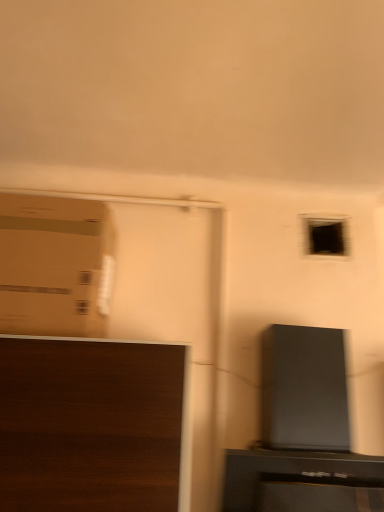
Question: Does cardboard box at left have a lesser width compared to dark wood cabinet at lower left?

Choices:
 (A) no
 (B) yes

Answer: (B)

Question: Is cardboard box at left closer to the viewer compared to dark wood cabinet at lower left?

Choices:
 (A) no
 (B) yes

Answer: (A)

Question: From a real-world perspective, is cardboard box at left on top of dark wood cabinet at lower left?

Choices:
 (A) no
 (B) yes

Answer: (B)

Question: From the image's perspective, is cardboard box at left below dark wood cabinet at lower left?

Choices:
 (A) no
 (B) yes

Answer: (A)

Question: Is cardboard box at left facing away from dark wood cabinet at lower left?

Choices:
 (A) yes
 (B) no

Answer: (B)

Question: Is cardboard box at left in contact with dark wood cabinet at lower left?

Choices:
 (A) no
 (B) yes

Answer: (A)

Question: From the image's perspective, does dark wood cabinet at lower left appear higher than cardboard box at left?

Choices:
 (A) no
 (B) yes

Answer: (A)

Question: Is dark wood cabinet at lower left looking in the opposite direction of cardboard box at left?

Choices:
 (A) no
 (B) yes

Answer: (A)

Question: Does dark wood cabinet at lower left touch cardboard box at left?

Choices:
 (A) yes
 (B) no

Answer: (B)

Question: Is dark wood cabinet at lower left at the left side of cardboard box at left?

Choices:
 (A) no
 (B) yes

Answer: (A)

Question: Does dark wood cabinet at lower left turn towards cardboard box at left?

Choices:
 (A) no
 (B) yes

Answer: (A)

Question: From a real-world perspective, is dark wood cabinet at lower left positioned under cardboard box at left based on gravity?

Choices:
 (A) no
 (B) yes

Answer: (B)

Question: Is point (97, 442) closer or farther from the camera than point (74, 296)?

Choices:
 (A) closer
 (B) farther

Answer: (A)